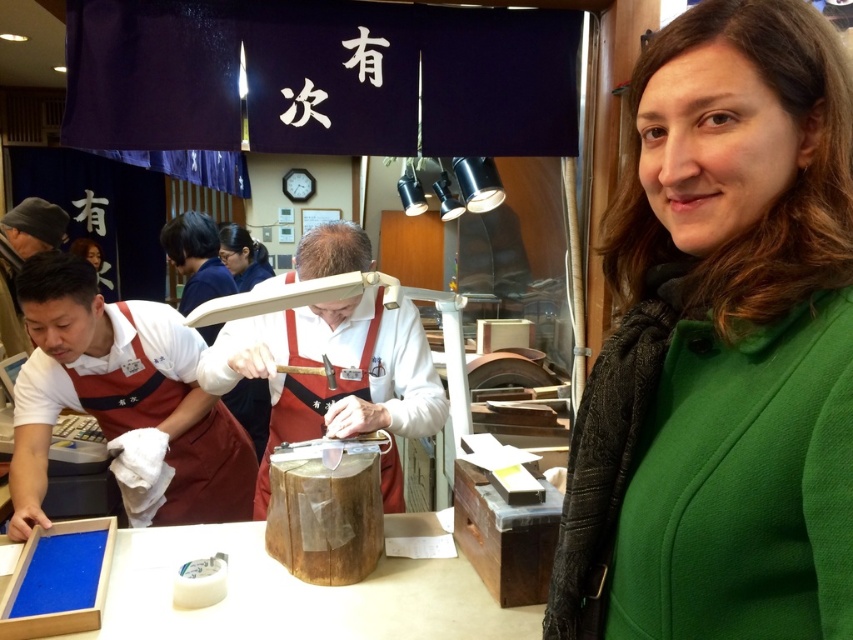
Question: Considering the real-world distances, which object is closest to the green woolen coat at right?

Choices:
 (A) white leather gloves at center
 (B) white cotton apron at left

Answer: (A)

Question: Is white cotton apron at left thinner than white leather gloves at center?

Choices:
 (A) no
 (B) yes

Answer: (B)

Question: Does white cotton apron at left have a larger size compared to white leather gloves at center?

Choices:
 (A) no
 (B) yes

Answer: (A)

Question: Which is farther from the green woolen coat at right?

Choices:
 (A) white cotton apron at left
 (B) white leather gloves at center

Answer: (A)

Question: Is green woolen coat at right to the left of white leather gloves at center from the viewer's perspective?

Choices:
 (A) yes
 (B) no

Answer: (B)

Question: Among these points, which one is nearest to the camera?

Choices:
 (A) (656, 356)
 (B) (360, 396)
 (C) (36, 333)

Answer: (A)